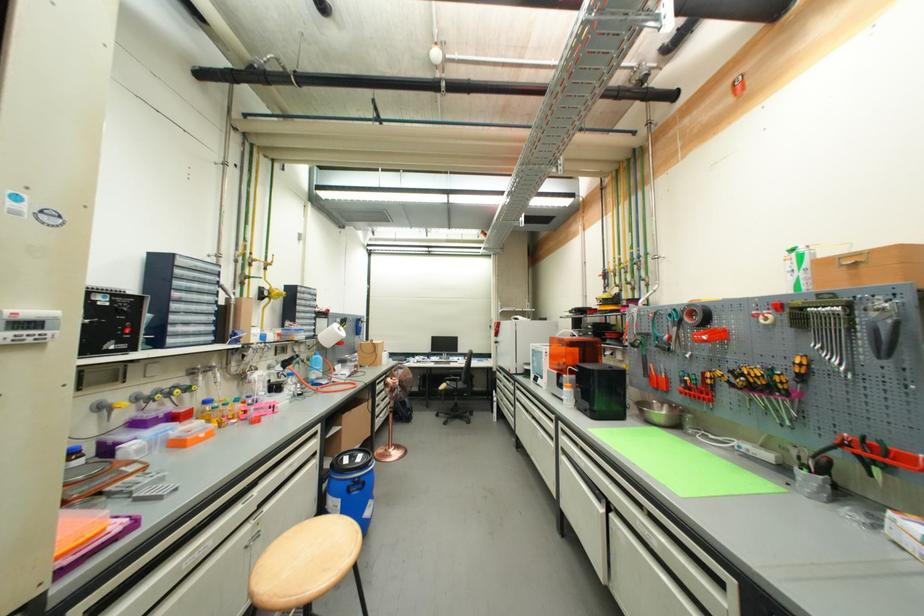
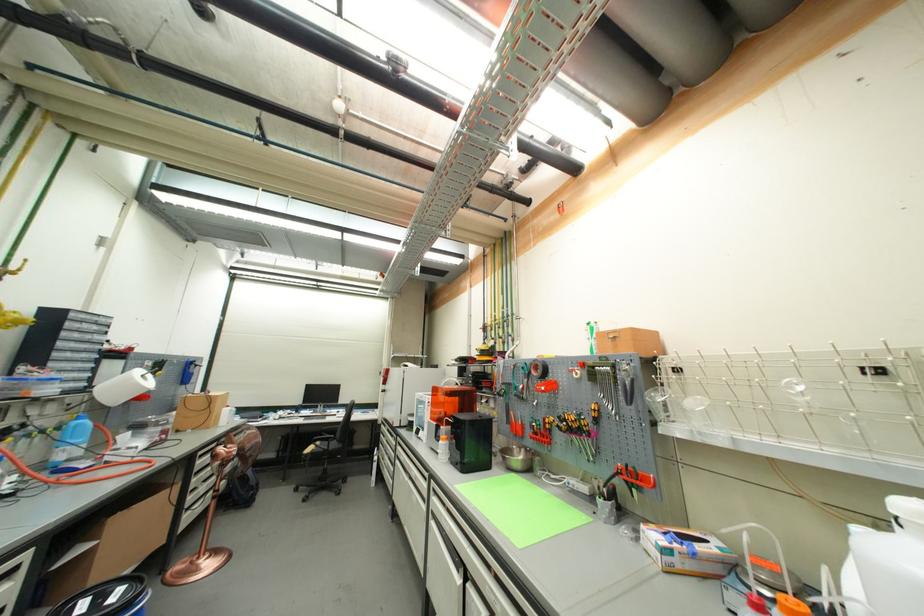
Where in the second image is the point corresponding to the point at 464,361 from the first image?

(344, 413)